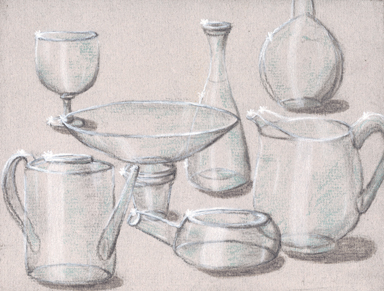
Locate an element on the screen. handles is located at coordinates (366, 127), (15, 162).